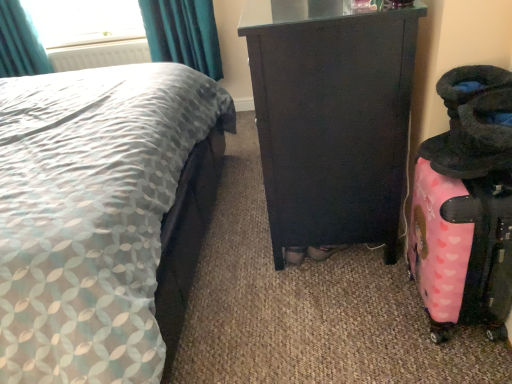
This screenshot has height=384, width=512. Find the location of `pink matte suitcase at right`. pink matte suitcase at right is located at coordinates (460, 252).

At what (x,y) coordinates should I click in order to perform the action: click on matte gray fabric bed at left. Please return your answer as a coordinate pair (x, y). Looking at the image, I should click on pos(93,215).

Locate an element on the screen. white plastic radiator at upper left is located at coordinates (99, 55).

This screenshot has height=384, width=512. I want to click on matte black cabinet at center, so click(331, 119).

From the image's perspective, is matte gray fabric bed at left located above matte black cabinet at center?

Actually, matte gray fabric bed at left appears below matte black cabinet at center in the image.

Between matte gray fabric bed at left and matte black cabinet at center, which one is positioned in front?

Positioned in front is matte gray fabric bed at left.

From a real-world perspective, is matte gray fabric bed at left below matte black cabinet at center?

Actually, matte gray fabric bed at left is physically above matte black cabinet at center in the real world.

Would you say matte gray fabric bed at left is a long distance from matte black cabinet at center?

matte gray fabric bed at left is near matte black cabinet at center, not far away.

Are white plastic radiator at upper left and pink matte suitcase at right far apart?

Absolutely, white plastic radiator at upper left is distant from pink matte suitcase at right.

Can you tell me how much white plastic radiator at upper left and pink matte suitcase at right differ in facing direction?

89 degrees separate the facing orientations of white plastic radiator at upper left and pink matte suitcase at right.

Is white plastic radiator at upper left outside of pink matte suitcase at right?

That's correct, white plastic radiator at upper left is outside of pink matte suitcase at right.

Does white plastic radiator at upper left have a greater height compared to pink matte suitcase at right?

Incorrect, the height of white plastic radiator at upper left is not larger of that of pink matte suitcase at right.

Considering the relative sizes of pink matte suitcase at right and matte black cabinet at center in the image provided, is pink matte suitcase at right taller than matte black cabinet at center?

Incorrect, the height of pink matte suitcase at right is not larger of that of matte black cabinet at center.

Does pink matte suitcase at right have a lesser width compared to matte black cabinet at center?

Yes.

Is point (431, 301) positioned behind point (336, 94)?

Yes, it is behind point (336, 94).

Looking at their sizes, would you say teal fabric curtain at upper left is wider or thinner than matte black cabinet at center?

Clearly, teal fabric curtain at upper left has less width compared to matte black cabinet at center.

Can you tell me how much teal fabric curtain at upper left and matte black cabinet at center differ in facing direction?

86.7 degrees.

From a real-world perspective, which object stands above the other?

teal fabric curtain at upper left, from a real-world perspective.

How distant is teal fabric curtain at upper left from matte black cabinet at center?

teal fabric curtain at upper left is 2.14 meters away from matte black cabinet at center.

Is white plastic radiator at upper left surrounded by pink matte suitcase at right?

No.

From a real-world perspective, is pink matte suitcase at right physically located above or below white plastic radiator at upper left?

Clearly, from a real-world perspective, pink matte suitcase at right is below white plastic radiator at upper left.

Is pink matte suitcase at right in front of or behind white plastic radiator at upper left in the image?

pink matte suitcase at right is in front of white plastic radiator at upper left.

Consider the image. How many degrees apart are the facing directions of pink matte suitcase at right and white plastic radiator at upper left?

They differ by 89 degrees in their facing directions.

Considering the positions of objects matte black cabinet at center and matte gray fabric bed at left in the image provided, who is more to the left, matte black cabinet at center or matte gray fabric bed at left?

Positioned to the left is matte gray fabric bed at left.

From the image's perspective, which object appears higher, matte black cabinet at center or matte gray fabric bed at left?

From the image's view, matte black cabinet at center is above.

From a real-world perspective, which is physically below, matte black cabinet at center or matte gray fabric bed at left?

In real-world perspective, matte black cabinet at center is lower.

From the image's perspective, would you say white plastic radiator at upper left is shown under matte black cabinet at center?

Incorrect, from the image's perspective, white plastic radiator at upper left is higher than matte black cabinet at center.

At what (x,y) coordinates should I click in order to perform the action: click on furniture located on the right of white plastic radiator at upper left. Please return your answer as a coordinate pair (x, y). Looking at the image, I should click on (331, 119).

From a real-world perspective, is white plastic radiator at upper left located beneath matte black cabinet at center?

No, from a real-world perspective, white plastic radiator at upper left is not below matte black cabinet at center.

There is a matte black cabinet at center. Identify the location of bed above it (from a real-world perspective). [93, 215].

At what (x,y) coordinates should I click in order to perform the action: click on luggage that appears on the right of white plastic radiator at upper left. Please return your answer as a coordinate pair (x, y). Looking at the image, I should click on (460, 252).

From the image, which object appears to be farther from white plastic radiator at upper left, matte black cabinet at center or pink matte suitcase at right?

pink matte suitcase at right is positioned further to the anchor white plastic radiator at upper left.

Looking at the image, which one is located closer to matte black cabinet at center, pink matte suitcase at right or matte gray fabric bed at left?

pink matte suitcase at right lies closer to matte black cabinet at center than the other object.

Based on their spatial positions, is pink matte suitcase at right or matte gray fabric bed at left closer to teal fabric curtain at upper left?

matte gray fabric bed at left is closer to teal fabric curtain at upper left.

Considering their positions, is teal fabric curtain at upper left positioned closer to pink matte suitcase at right than matte gray fabric bed at left?

matte gray fabric bed at left is positioned closer to the anchor pink matte suitcase at right.

Which object lies further to the anchor point pink matte suitcase at right, teal fabric curtain at upper left or matte black cabinet at center?

teal fabric curtain at upper left lies further to pink matte suitcase at right than the other object.

Considering their positions, is teal fabric curtain at upper left positioned closer to matte gray fabric bed at left than pink matte suitcase at right?

pink matte suitcase at right is positioned closer to the anchor matte gray fabric bed at left.

Based on their spatial positions, is pink matte suitcase at right or white plastic radiator at upper left further from teal fabric curtain at upper left?

pink matte suitcase at right.

Considering their positions, is matte gray fabric bed at left positioned further to matte black cabinet at center than white plastic radiator at upper left?

Among the two, white plastic radiator at upper left is located further to matte black cabinet at center.

Where is `furniture between matte gray fabric bed at left and white plastic radiator at upper left in the front-back direction`? Image resolution: width=512 pixels, height=384 pixels. furniture between matte gray fabric bed at left and white plastic radiator at upper left in the front-back direction is located at coordinates (331, 119).

You are a GUI agent. You are given a task and a screenshot of the screen. Output one action in this format:
    pyautogui.click(x=<x>, y=<y>)
    Task: Click on the bed situated between teal fabric curtain at upper left and pink matte suitcase at right from left to right
    
    Given the screenshot: What is the action you would take?
    pyautogui.click(x=93, y=215)

This screenshot has width=512, height=384. I want to click on furniture between matte gray fabric bed at left and teal fabric curtain at upper left in the front-back direction, so click(x=331, y=119).

The height and width of the screenshot is (384, 512). In order to click on radiator between teal fabric curtain at upper left and pink matte suitcase at right in the horizontal direction in this screenshot , I will do `click(99, 55)`.